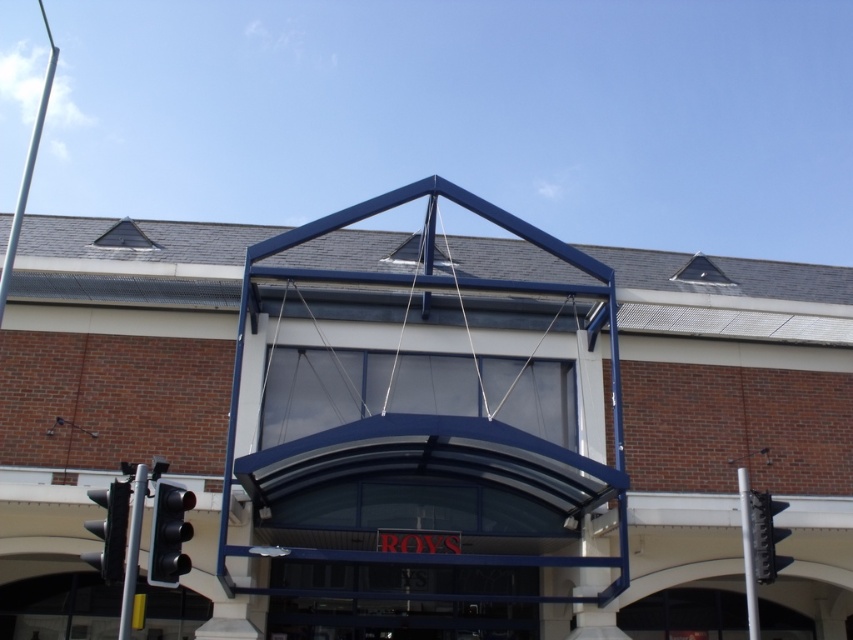
Can you confirm if black glass traffic light at right is taller than metallic traffic light pole at lower left?

Incorrect, black glass traffic light at right's height is not larger of metallic traffic light pole at lower left's.

Is black glass traffic light at right positioned at the back of metallic traffic light pole at lower left?

Yes, black glass traffic light at right is further from the viewer.

Does point (756, 556) come behind point (136, 486)?

Yes, it is.

Find the location of `black glass traffic light at right`. black glass traffic light at right is located at coordinates (766, 536).

Which is in front, point (151, 528) or point (759, 552)?

Positioned in front is point (151, 528).

Can you confirm if black matte traffic light at lower left is positioned to the left of black glass traffic light at right?

Yes, black matte traffic light at lower left is to the left of black glass traffic light at right.

Find the location of a particular element. black matte traffic light at lower left is located at coordinates (169, 534).

I want to click on black matte traffic light at lower left, so click(x=169, y=534).

Can you confirm if black glass traffic light at right is positioned to the left of silver metallic pole at right?

No, black glass traffic light at right is not to the left of silver metallic pole at right.

Is the position of black glass traffic light at right more distant than that of silver metallic pole at right?

That is False.

Between point (767, 547) and point (752, 588), which one is positioned in front?

Point (767, 547) is in front.

The height and width of the screenshot is (640, 853). I want to click on black glass traffic light at right, so click(766, 536).